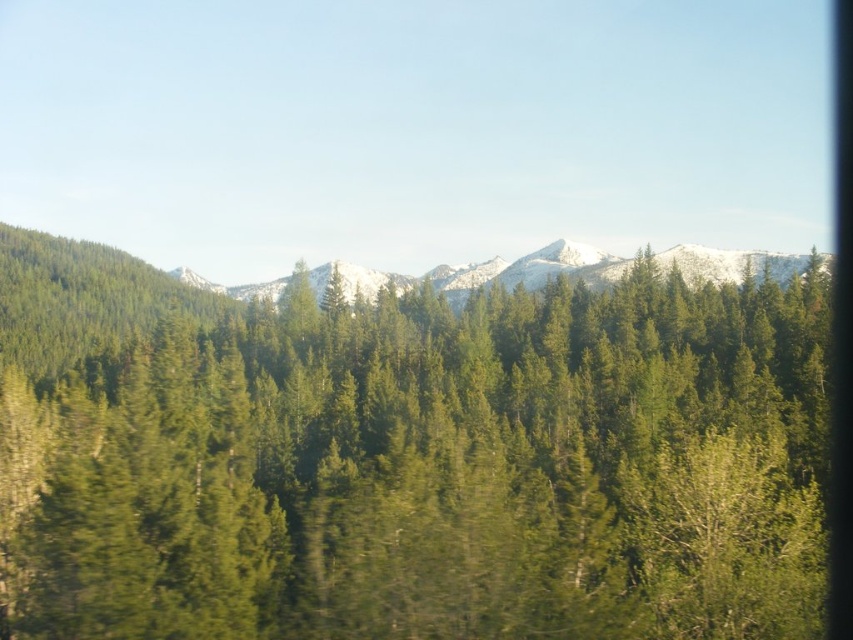
You are standing at the point marked by the coordinate (x=407, y=458) in the forest scene. What object is located exactly at that position?

The point marked by the coordinate (x=407, y=458) is located exactly at the green matte tree at center.

You are a hiker standing at the edge of the forest looking towards the mountains. You see the green matte tree at center and the snowy rocky mountain at center. Which object is positioned more to the east if the sun is setting in the west?

The green matte tree at center is to the left of the snowy rocky mountain at center. Since the sun is setting in the west, the east side would be to the left from the observer. Therefore, the green matte tree at center is positioned more to the east.

You are standing at the viewpoint and see two points marked in the image. The first point is at coordinates point (239,355) and the second is at point (566,260). Which point is closer to you?

Point (239,355) is in front of point (566,260), so it is closer to you.